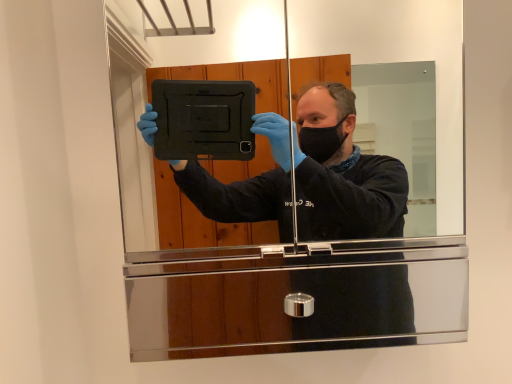
The image size is (512, 384). What do you see at coordinates (259, 257) in the screenshot?
I see `polished silver mirror at center` at bounding box center [259, 257].

Identify the location of polished silver mirror at center. This screenshot has width=512, height=384. 259,257.

Identify the location of polished silver mirror at center. The image size is (512, 384). (259, 257).